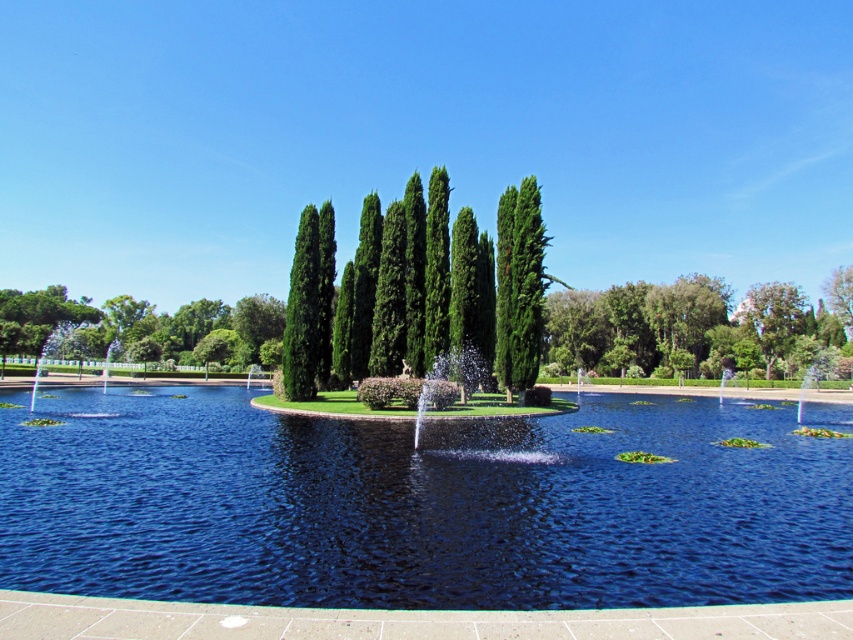
Describe the element at coordinates (142, 317) in the screenshot. I see `green glossy tree at upper center` at that location.

Does green glossy tree at upper center have a greater height compared to white glossy fountain at left?

Indeed, green glossy tree at upper center has a greater height compared to white glossy fountain at left.

In order to click on green glossy tree at upper center in this screenshot , I will do `click(142, 317)`.

The image size is (853, 640). Identify the location of green glossy tree at upper center. (142, 317).

Who is lower down, green leafy tree at center or white glossy fountain at left?

white glossy fountain at left is lower down.

In the scene shown: Does green leafy tree at center have a greater height compared to white glossy fountain at left?

Yes, green leafy tree at center is taller than white glossy fountain at left.

The image size is (853, 640). Identify the location of green leafy tree at center. (634, 323).

Identify the location of green leafy tree at center. The height and width of the screenshot is (640, 853). (634, 323).

Consider the image. Who is taller, green leafy tree at center or green glossy trees at center?

With more height is green leafy tree at center.

Who is higher up, green leafy tree at center or green glossy trees at center?

Positioned higher is green glossy trees at center.

Does point (631, 298) lie in front of point (537, 308)?

No, it is not.

You are a GUI agent. You are given a task and a screenshot of the screen. Output one action in this format:
    pyautogui.click(x=<x>, y=<y>)
    Task: Click on the green leafy tree at center
    This screenshot has height=640, width=853.
    Given the screenshot: What is the action you would take?
    (634, 323)